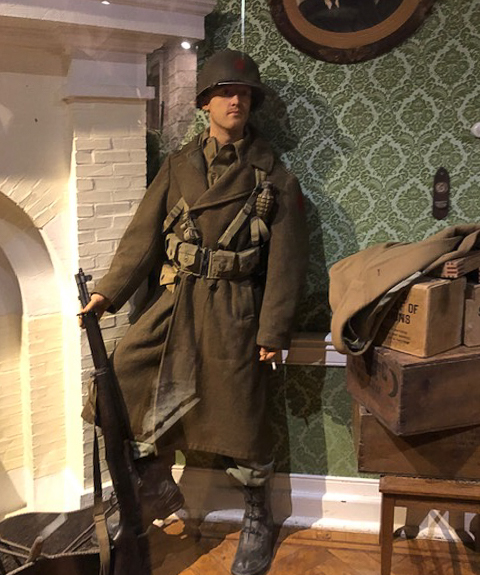
Where is `crate`? The image size is (480, 575). crate is located at coordinates (429, 394).